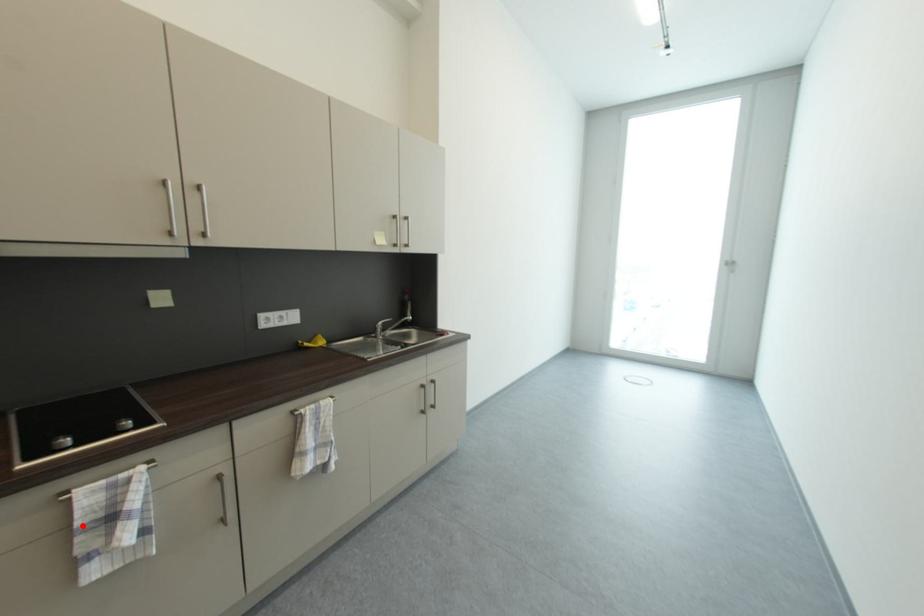
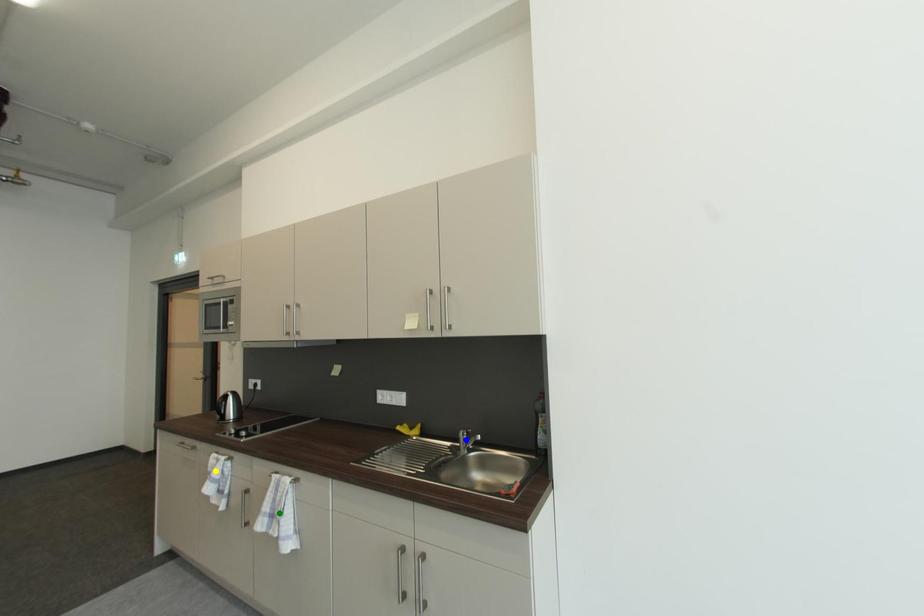
Question: I am providing you with two images of the same scene from different viewpoints. A red point is marked on the first image. You are given multiple points on the second image. Which mark in image 2 goes with the point in image 1?

Choices:
 (A) yellow point
 (B) blue point
 (C) green point

Answer: (A)